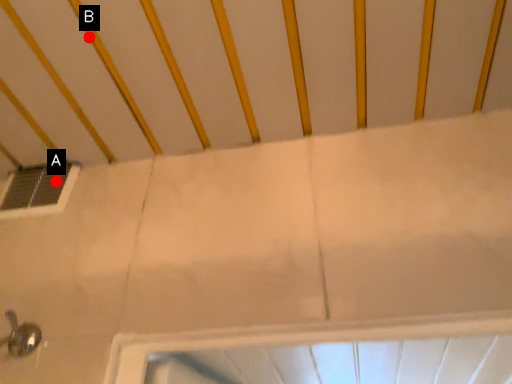
Question: Two points are circled on the image, labeled by A and B beside each circle. Which point appears closest to the camera in this image?

Choices:
 (A) A is closer
 (B) B is closer

Answer: (B)